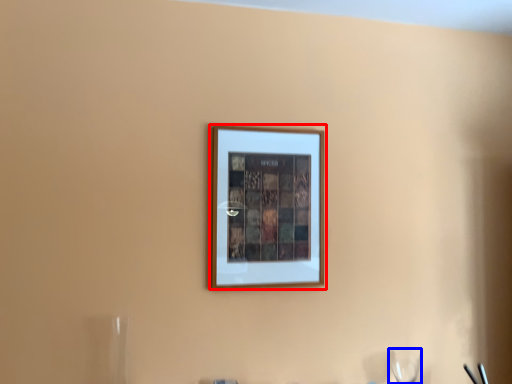
Question: Among these objects, which one is nearest to the camera, picture frame (highlighted by a red box) or wine glass (highlighted by a blue box)?

Choices:
 (A) picture frame
 (B) wine glass

Answer: (A)